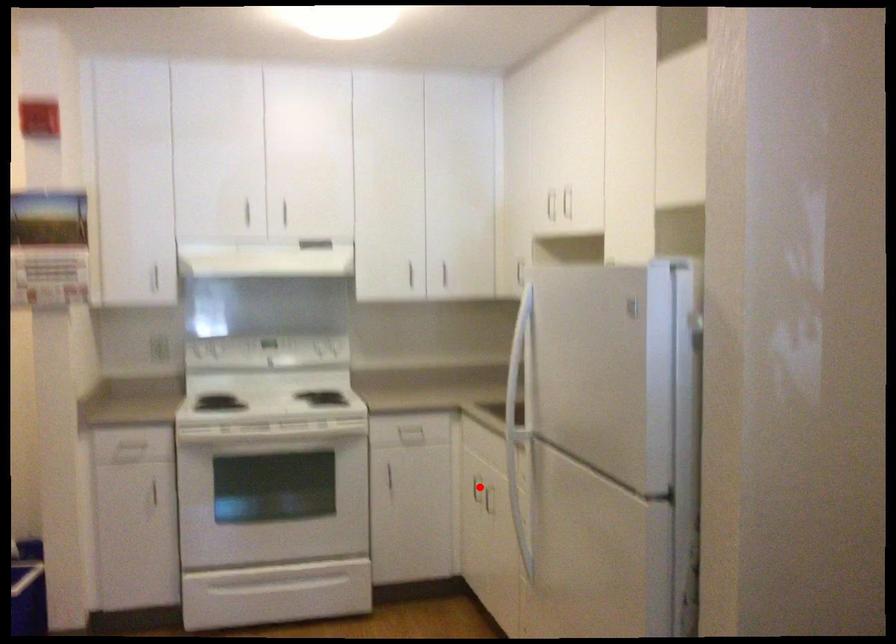
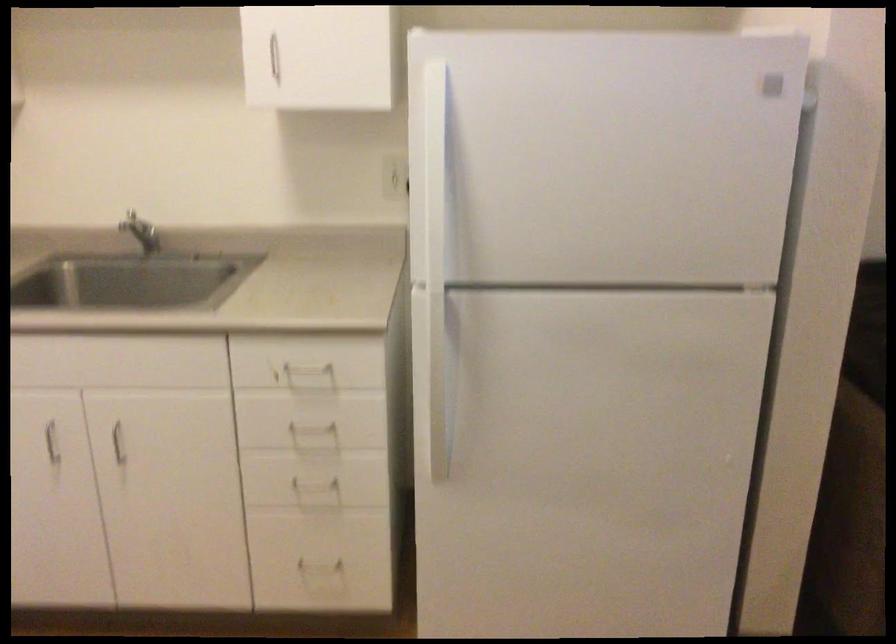
In the second image, find the point that corresponds to the highlighted location in the first image.

(52, 442)